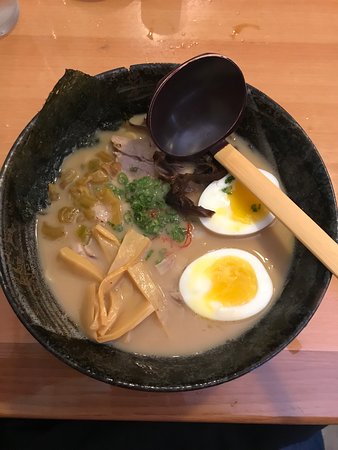
I want to click on table, so click(x=276, y=399).